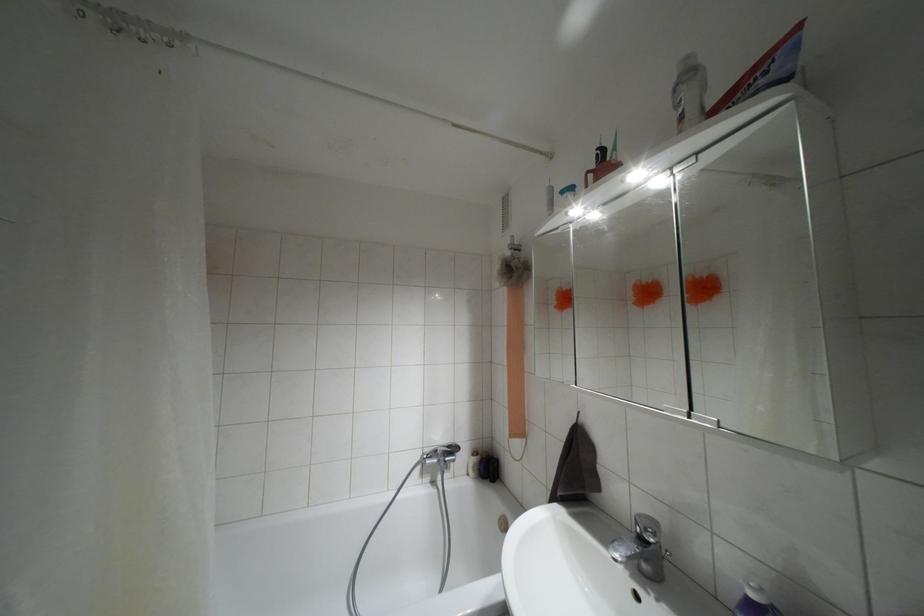
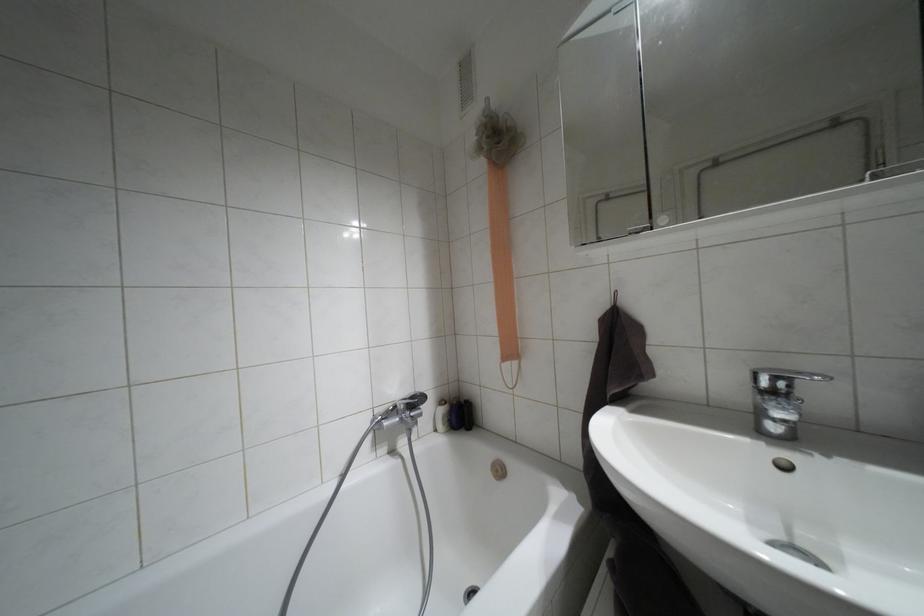
Which direction would the cameraman need to move to produce the second image?

The movement direction of the cameraman is left, forward.